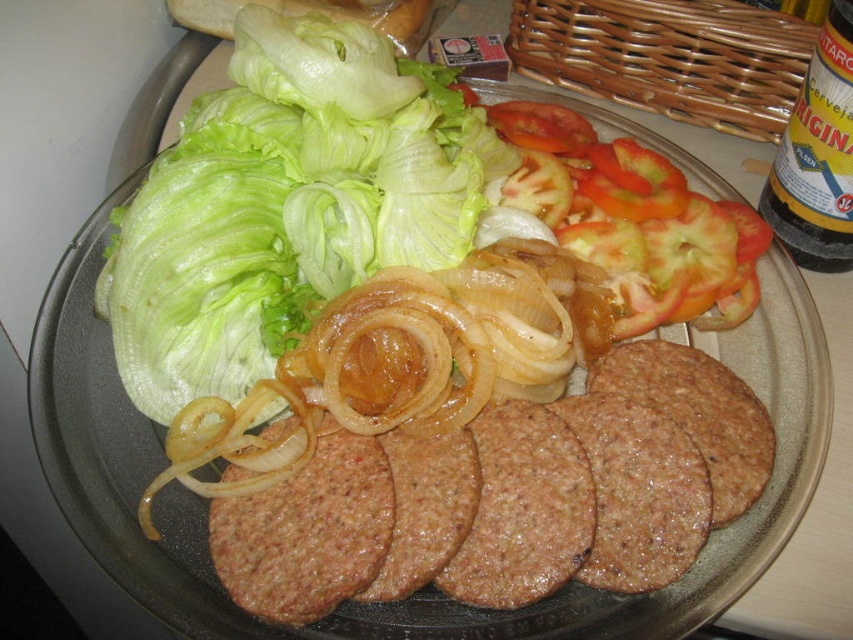
In the scene shown: Who is higher up, green leafy lettuce at upper left or sliced red tomato at upper right?

green leafy lettuce at upper left is above.

Is green leafy lettuce at upper left below sliced red tomato at upper right?

Actually, green leafy lettuce at upper left is above sliced red tomato at upper right.

Locate an element on the screen. Image resolution: width=853 pixels, height=640 pixels. green leafy lettuce at upper left is located at coordinates (287, 204).

Identify the location of green leafy lettuce at upper left. (287, 204).

Does sliced red tomato at upper right appear over yellow glass bottle at upper right?

Incorrect, sliced red tomato at upper right is not positioned above yellow glass bottle at upper right.

Does sliced red tomato at upper right have a smaller size compared to yellow glass bottle at upper right?

Actually, sliced red tomato at upper right might be larger than yellow glass bottle at upper right.

Locate an element on the screen. sliced red tomato at upper right is located at coordinates (634, 221).

What do you see at coordinates (287, 204) in the screenshot?
I see `green leafy lettuce at upper left` at bounding box center [287, 204].

Which is behind, point (326, 68) or point (784, 150)?

Positioned behind is point (784, 150).

The height and width of the screenshot is (640, 853). Find the location of `green leafy lettuce at upper left`. green leafy lettuce at upper left is located at coordinates (287, 204).